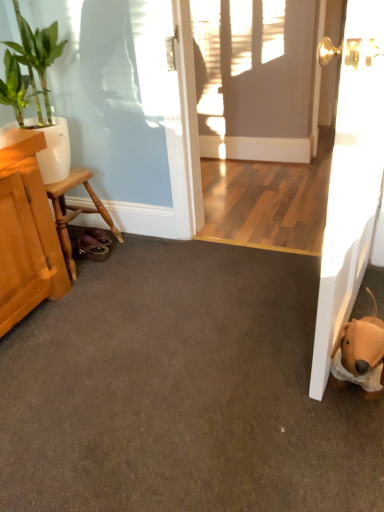
Where is `vacant area that lies between white glossy door at right and wooden stool at left`? vacant area that lies between white glossy door at right and wooden stool at left is located at coordinates (208, 292).